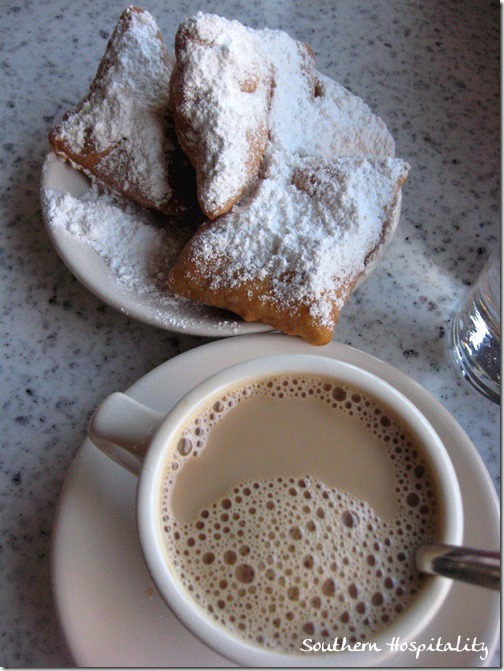
Locate an element on the screen. This screenshot has height=671, width=504. dish is located at coordinates (112, 604).